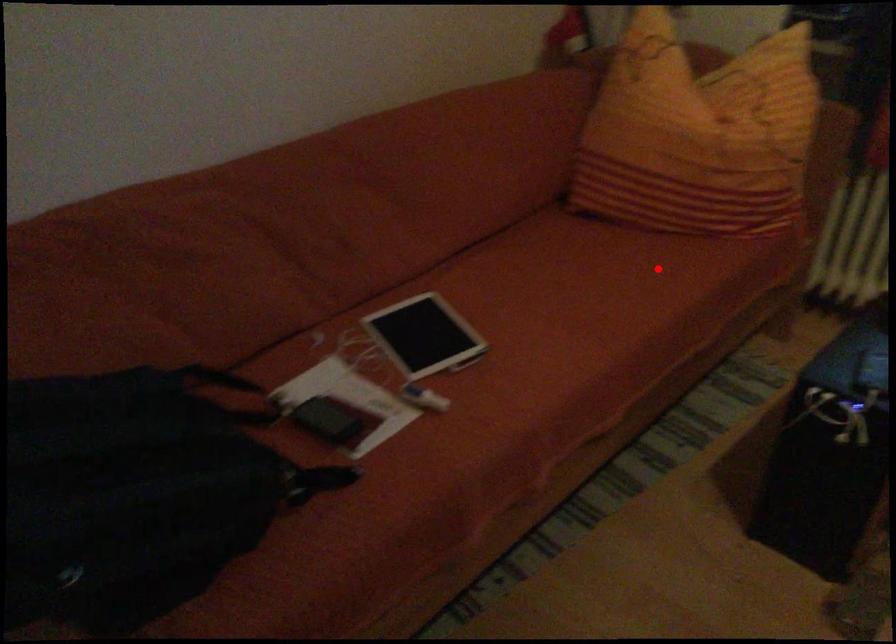
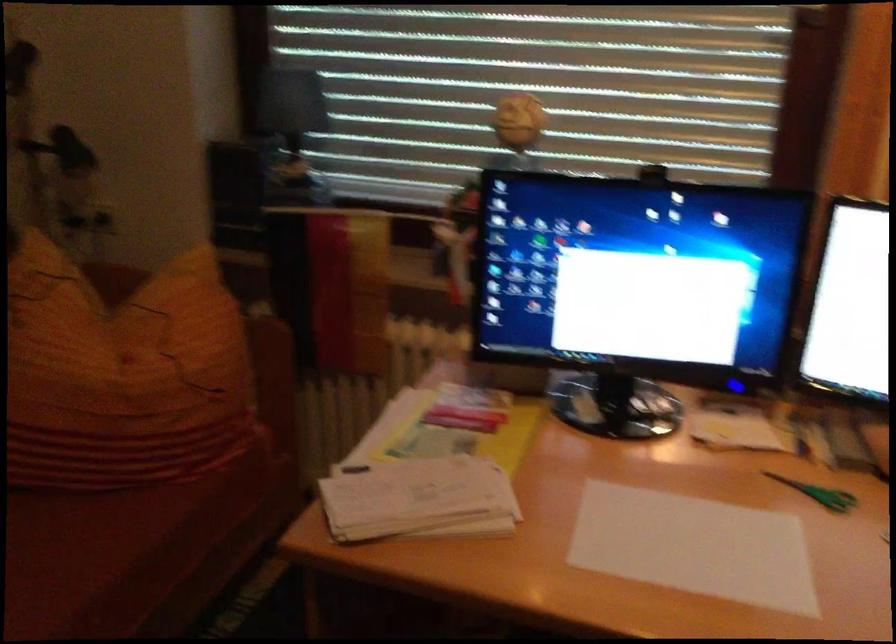
In the second image, find the point that corresponds to the highlighted location in the first image.

(66, 556)